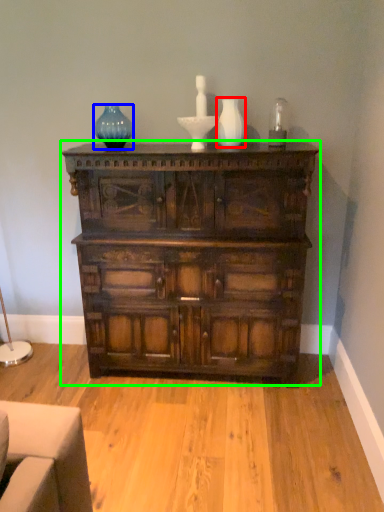
Question: Which is nearer to the vase (highlighted by a red box)? glass vase (highlighted by a blue box) or chest of drawers (highlighted by a green box).

Choices:
 (A) glass vase
 (B) chest of drawers

Answer: (A)